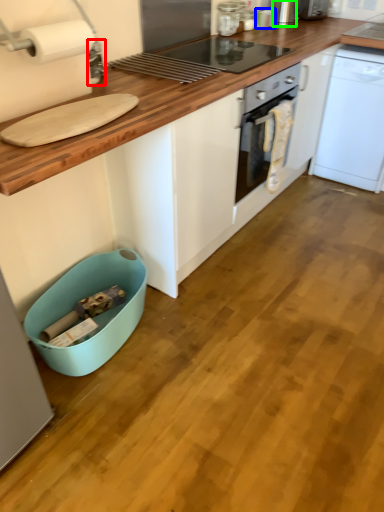
Question: Which object is the closest to the appliance (highlighted by a red box)? Choose among these: appliance (highlighted by a blue box) or appliance (highlighted by a green box).

Choices:
 (A) appliance
 (B) appliance

Answer: (A)